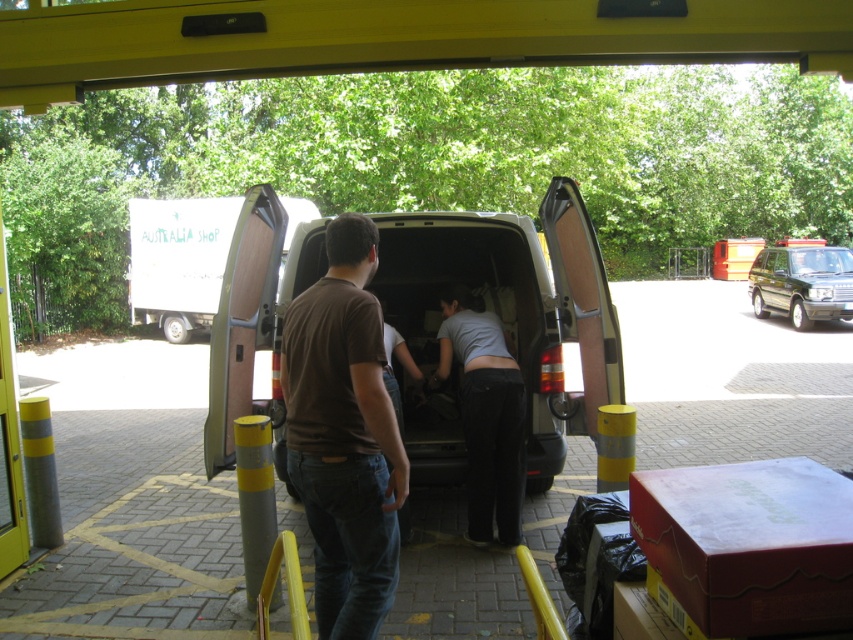
Between brown cotton t-shirt at center and green matte suv at right, which one is positioned higher?

Positioned higher is green matte suv at right.

Between point (341, 625) and point (809, 298), which one is positioned behind?

Positioned behind is point (809, 298).

Where is `brown cotton t-shirt at center`? This screenshot has height=640, width=853. brown cotton t-shirt at center is located at coordinates (344, 435).

Who is shorter, matte gray van at center or green matte suv at right?

green matte suv at right is shorter.

Is matte gray van at center below green matte suv at right?

Indeed, matte gray van at center is positioned under green matte suv at right.

Does point (273, 276) lie in front of point (751, 280)?

Yes, point (273, 276) is closer to viewer.

Locate an element on the screen. This screenshot has height=640, width=853. matte gray van at center is located at coordinates (514, 305).

Does matte gray van at center appear on the right side of brown cotton t-shirt at center?

Correct, you'll find matte gray van at center to the right of brown cotton t-shirt at center.

Is matte gray van at center closer to the viewer compared to brown cotton t-shirt at center?

No.

Between point (502, 257) and point (302, 336), which one is positioned in front?

Point (302, 336) is in front.

The image size is (853, 640). In order to click on matte gray van at center in this screenshot , I will do `click(514, 305)`.